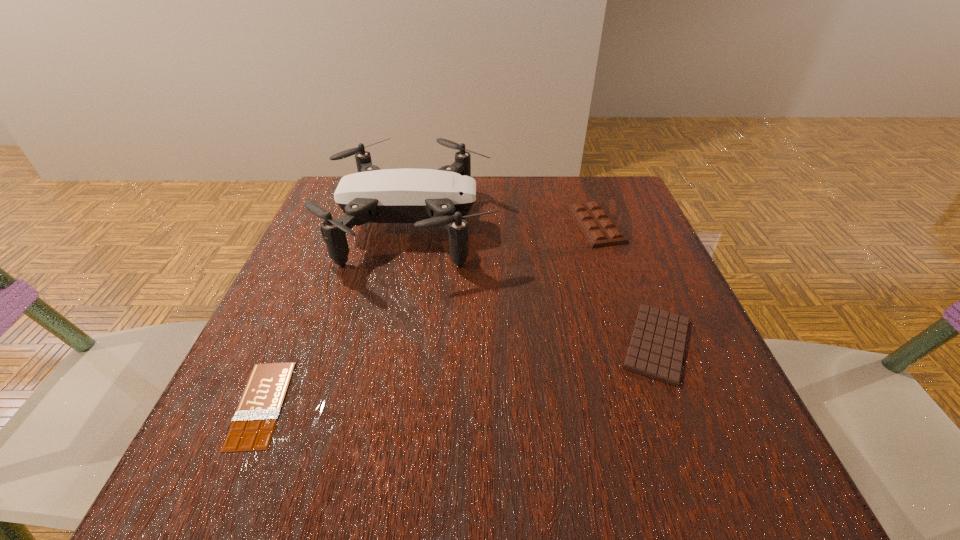
Where is `vacant space that satisfies the following two spatial constraints: 1. on the camera side of the drone; 2. on the back side of the second shortest chocolate bar`? vacant space that satisfies the following two spatial constraints: 1. on the camera side of the drone; 2. on the back side of the second shortest chocolate bar is located at coordinates (389, 343).

I want to click on vacant point that satisfies the following two spatial constraints: 1. on the camera side of the tallest object; 2. on the left side of the second shortest chocolate bar, so pyautogui.click(x=389, y=343).

Locate an element on the screen. The height and width of the screenshot is (540, 960). free point that satisfies the following two spatial constraints: 1. on the front side of the second tallest chocolate bar; 2. on the left side of the tallest chocolate bar is located at coordinates (637, 343).

At what (x,y) coordinates should I click in order to perform the action: click on free space that satisfies the following two spatial constraints: 1. on the camera side of the drone; 2. on the left side of the second tallest chocolate bar. Please return your answer as a coordinate pair (x, y). The height and width of the screenshot is (540, 960). Looking at the image, I should click on (389, 343).